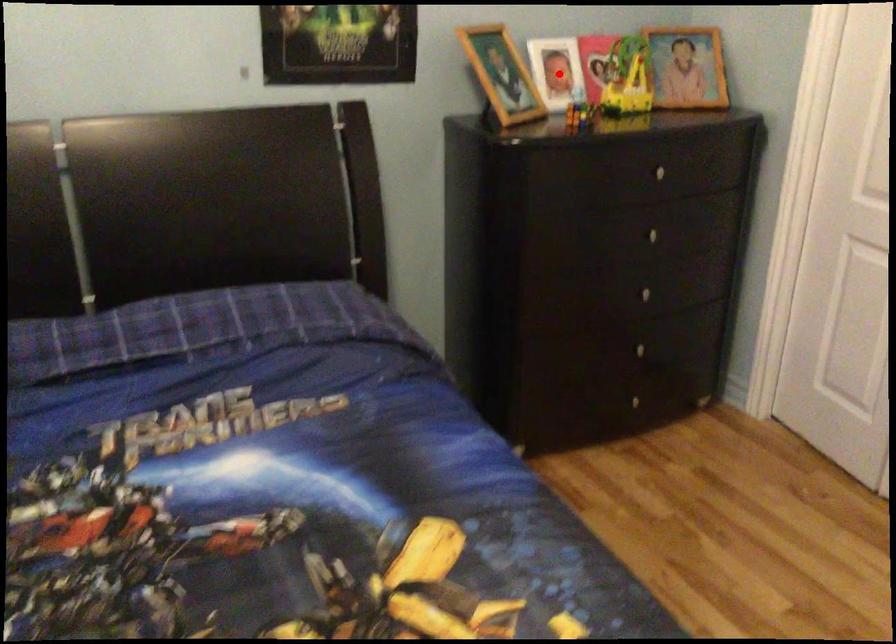
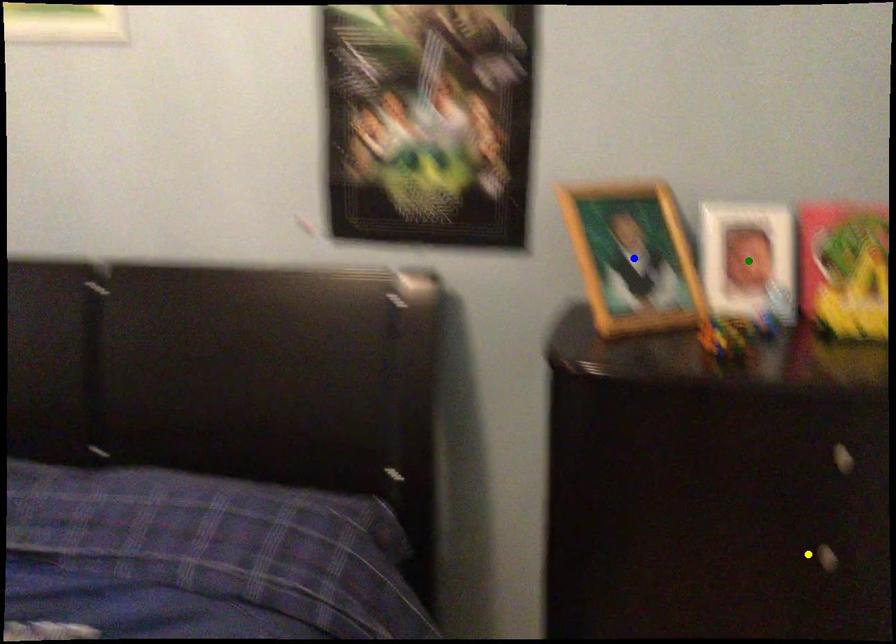
Question: I am providing you with two images of the same scene from different viewpoints. A red point is marked on the first image. You are given multiple points on the second image. Which point in image 2 is actually the same real-world point as the red point in image 1?

Choices:
 (A) blue point
 (B) yellow point
 (C) green point

Answer: (C)